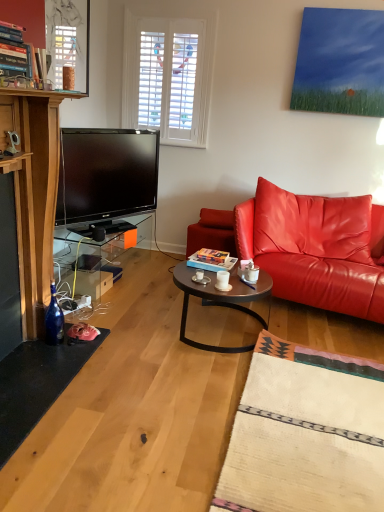
In order to face shiny leather couch at right, should I rotate leftwards or rightwards?

Turn right by 17.339 degrees to look at shiny leather couch at right.

What are the coordinates of `metallic round table at center` in the screenshot? It's located at (221, 301).

Identify the location of transparent glass table at lower left. (98, 254).

What is the approximate height of white ceramic mug at center?

It is 3.41 inches.

Identify the location of metallic glass window screen at upper left. (68, 41).

Which object is closer to the camera, metallic glass window screen at upper left or transparent glass table at lower left?

metallic glass window screen at upper left.

Could you tell me if metallic glass window screen at upper left is facing transparent glass table at lower left?

No, metallic glass window screen at upper left is not aimed at transparent glass table at lower left.

Looking at their sizes, would you say metallic glass window screen at upper left is wider or thinner than transparent glass table at lower left?

Clearly, metallic glass window screen at upper left has less width compared to transparent glass table at lower left.

Is transparent glass table at lower left inside or outside of white ceramic mug at center?

transparent glass table at lower left is located beyond the bounds of white ceramic mug at center.

Can you confirm if transparent glass table at lower left is positioned to the right of white ceramic mug at center?

No.

Looking at this image, is transparent glass table at lower left oriented away from white ceramic mug at center?

That's not correct — transparent glass table at lower left is not looking away from white ceramic mug at center.

Which is closer, (84, 236) or (228, 284)?

The point (228, 284) is in front.

In terms of width, does metallic round table at center look wider or thinner when compared to shiny leather couch at right?

Clearly, metallic round table at center has less width compared to shiny leather couch at right.

From the picture: From a real-world perspective, is metallic round table at center beneath shiny leather couch at right?

Yes.

Would you say metallic round table at center is a long distance from shiny leather couch at right?

metallic round table at center is actually quite close to shiny leather couch at right.

Does metallic round table at center have a lesser height compared to shiny leather couch at right?

Correct, metallic round table at center is not as tall as shiny leather couch at right.

Based on the photo, considering the sizes of objects blue glass bottle at lower left and metallic glass window screen at upper left in the image provided, who is thinner, blue glass bottle at lower left or metallic glass window screen at upper left?

Thinner between the two is metallic glass window screen at upper left.

Does point (54, 343) appear closer or farther from the camera than point (51, 21)?

Point (54, 343) is positioned closer to the camera compared to point (51, 21).

How far apart are blue glass bottle at lower left and metallic glass window screen at upper left?

The distance of blue glass bottle at lower left from metallic glass window screen at upper left is 1.88 meters.

Who is smaller, metallic round table at center or white ceramic mug at center?

Smaller between the two is white ceramic mug at center.

Does metallic round table at center touch white ceramic mug at center?

No, metallic round table at center is not with white ceramic mug at center.

Is metallic round table at center facing towards white ceramic mug at center?

No, metallic round table at center is not facing towards white ceramic mug at center.

Considering their positions, is shiny leather couch at right located in front of or behind transparent glass table at lower left?

shiny leather couch at right is positioned closer to the viewer than transparent glass table at lower left.

From a real-world perspective, who is located lower, shiny leather couch at right or transparent glass table at lower left?

transparent glass table at lower left is physically lower.

The height and width of the screenshot is (512, 384). What are the coordinates of `studio couch lying in front of the transparent glass table at lower left` in the screenshot? It's located at (306, 249).

From the image's perspective, is shiny leather couch at right over transparent glass table at lower left?

Correct, shiny leather couch at right appears higher than transparent glass table at lower left in the image.

From the image's perspective, is white ceramic mug at center on transparent glass table at lower left?

Incorrect, from the image's perspective, white ceramic mug at center is lower than transparent glass table at lower left.

From a real-world perspective, who is located higher, white ceramic mug at center or transparent glass table at lower left?

white ceramic mug at center is physically above.

Between white ceramic mug at center and transparent glass table at lower left, which one appears on the right side from the viewer's perspective?

Positioned to the right is white ceramic mug at center.

Which of these two, white ceramic mug at center or transparent glass table at lower left, is smaller?

white ceramic mug at center.

There is a transparent glass table at lower left. In order to click on window screen above it (from a real-world perspective) in this screenshot , I will do `click(68, 41)`.

Find the location of a particular element. This screenshot has width=384, height=512. table behind the white ceramic mug at center is located at coordinates (98, 254).

Estimate the real-world distances between objects in this image. Which object is further from shiny leather couch at right, metallic glass window screen at upper left or white ceramic mug at center?

metallic glass window screen at upper left is further to shiny leather couch at right.

From the image, which object appears to be farther from metallic glass window screen at upper left, transparent glass table at lower left or blue glass bottle at lower left?

blue glass bottle at lower left.

When comparing their distances from shiny leather couch at right, does white ceramic mug at center or metallic glass window screen at upper left seem further?

metallic glass window screen at upper left.

Looking at the image, which one is located further to shiny leather couch at right, metallic glass window screen at upper left or transparent glass table at lower left?

The object further to shiny leather couch at right is metallic glass window screen at upper left.

Considering their positions, is blue glass bottle at lower left positioned further to white ceramic mug at center than shiny leather couch at right?

blue glass bottle at lower left is positioned further to the anchor white ceramic mug at center.

Estimate the real-world distances between objects in this image. Which object is further from metallic glass window screen at upper left, metallic round table at center or transparent glass table at lower left?

metallic round table at center is further to metallic glass window screen at upper left.

When comparing their distances from white ceramic mug at center, does metallic glass window screen at upper left or blue glass bottle at lower left seem further?

Among the two, metallic glass window screen at upper left is located further to white ceramic mug at center.

From the image, which object appears to be nearer to metallic glass window screen at upper left, metallic round table at center or white ceramic mug at center?

Among the two, metallic round table at center is located nearer to metallic glass window screen at upper left.

Identify the location of coffee cup that lies between metallic glass window screen at upper left and blue glass bottle at lower left from top to bottom. This screenshot has width=384, height=512. (222, 281).

Identify the location of coffee cup between blue glass bottle at lower left and shiny leather couch at right in the horizontal direction. This screenshot has height=512, width=384. (222, 281).

You are a GUI agent. You are given a task and a screenshot of the screen. Output one action in this format:
    pyautogui.click(x=<x>, y=<y>)
    Task: Click on the table between metallic glass window screen at upper left and metallic round table at center in the vertical direction
    The width and height of the screenshot is (384, 512).
    Given the screenshot: What is the action you would take?
    pyautogui.click(x=98, y=254)

Locate an element on the screen. The width and height of the screenshot is (384, 512). coffee cup between metallic glass window screen at upper left and metallic round table at center in the vertical direction is located at coordinates (222, 281).